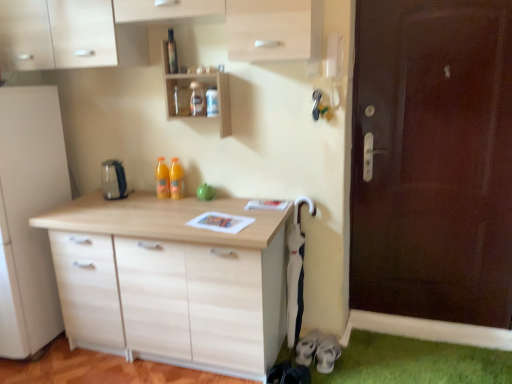
Question: Is wooden shelf at upper center in front of transparent glass bottle at upper center, the 2th bottle from the back?

Choices:
 (A) yes
 (B) no

Answer: (A)

Question: Is wooden shelf at upper center oriented away from transparent glass bottle at upper center, acting as the 2th bottle starting from the bottom?

Choices:
 (A) yes
 (B) no

Answer: (A)

Question: Is wooden shelf at upper center behind transparent glass bottle at upper center, the 2th bottle from the back?

Choices:
 (A) no
 (B) yes

Answer: (A)

Question: From a real-world perspective, is wooden shelf at upper center on top of transparent glass bottle at upper center, acting as the 2th bottle starting from the bottom?

Choices:
 (A) yes
 (B) no

Answer: (B)

Question: Can we say wooden shelf at upper center lies outside transparent glass bottle at upper center, acting as the 2th bottle starting from the bottom?

Choices:
 (A) yes
 (B) no

Answer: (A)

Question: From a real-world perspective, relative to wooden shelf at upper center, is orange translucent bottle at center, the first bottle viewed from the left, vertically above or below?

Choices:
 (A) below
 (B) above

Answer: (A)

Question: In terms of width, does orange translucent bottle at center, the 2th bottle when ordered from right to left, look wider or thinner when compared to wooden shelf at upper center?

Choices:
 (A) thin
 (B) wide

Answer: (A)

Question: From the image's perspective, is orange translucent bottle at center, marked as the 1th bottle in a bottom-to-top arrangement, positioned above or below wooden shelf at upper center?

Choices:
 (A) below
 (B) above

Answer: (A)

Question: In terms of height, does orange translucent bottle at center, the 2th bottle when ordered from right to left, look taller or shorter compared to wooden shelf at upper center?

Choices:
 (A) short
 (B) tall

Answer: (A)

Question: From their relative heights in the image, would you say transparent glass bottle at upper center, the 2th bottle from the back, is taller or shorter than satin silver kettle at center?

Choices:
 (A) tall
 (B) short

Answer: (A)

Question: Choose the correct answer: Is transparent glass bottle at upper center, positioned as the 1th bottle in front-to-back order, inside satin silver kettle at center or outside it?

Choices:
 (A) outside
 (B) inside

Answer: (A)

Question: Would you say transparent glass bottle at upper center, the 2th bottle from the back, is to the left or to the right of satin silver kettle at center in the picture?

Choices:
 (A) left
 (B) right

Answer: (B)

Question: Is transparent glass bottle at upper center, marked as the second bottle in a left-to-right arrangement, in front of or behind satin silver kettle at center in the image?

Choices:
 (A) behind
 (B) front

Answer: (B)

Question: From the image's perspective, is satin silver kettle at center positioned above or below orange translucent bottle at center, the 2th bottle when ordered from front to back?

Choices:
 (A) above
 (B) below

Answer: (B)

Question: In the image, is satin silver kettle at center positioned in front of or behind orange translucent bottle at center, marked as the 1th bottle in a bottom-to-top arrangement?

Choices:
 (A) front
 (B) behind

Answer: (A)